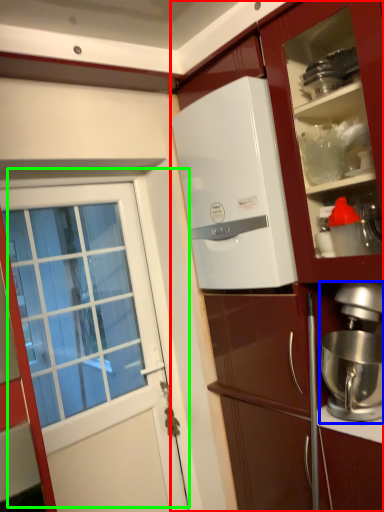
Question: Estimate the real-world distances between objects in this image. Which object is closer to cabinetry (highlighted by a red box), kitchen appliance (highlighted by a blue box) or door (highlighted by a green box)?

Choices:
 (A) kitchen appliance
 (B) door

Answer: (A)